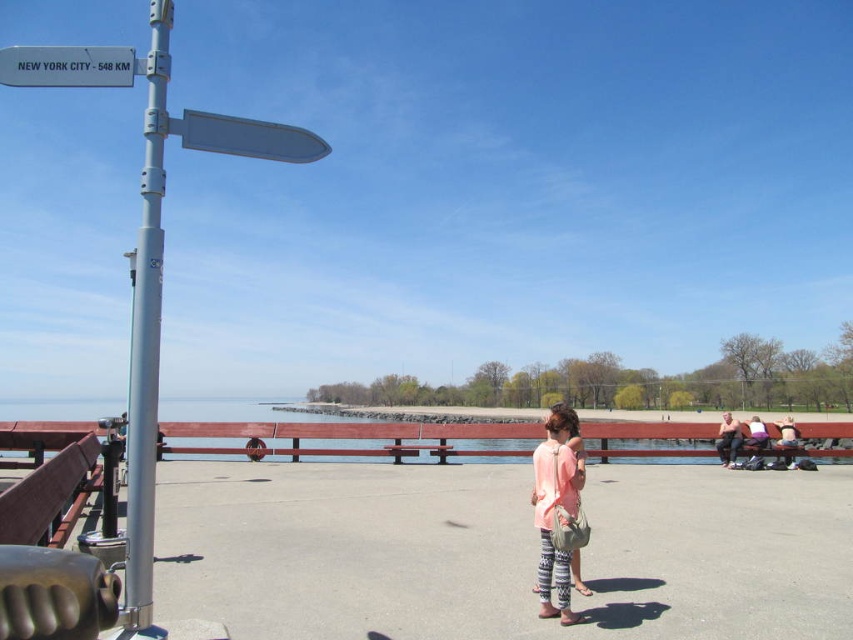
Based on the photo, you are standing at the waterfront promenade and see both the tan leather jacket at right and the pink fabric person at right. Which object is positioned to the left when viewed from your perspective?

The tan leather jacket at right is positioned to the left of the pink fabric person at right.

You are standing on the waterfront promenade and see the silver metallic pole at left and the light pink fabric dress at center. Which object is higher from the ground?

The silver metallic pole at left is above the light pink fabric dress at center, so the silver metallic pole at left is higher from the ground.

You are standing at the waterfront promenade and see the silver metallic pole at left and the tan leather jacket at right. Which object appears smaller in size?

The silver metallic pole at left appears smaller in size compared to the tan leather jacket at right.